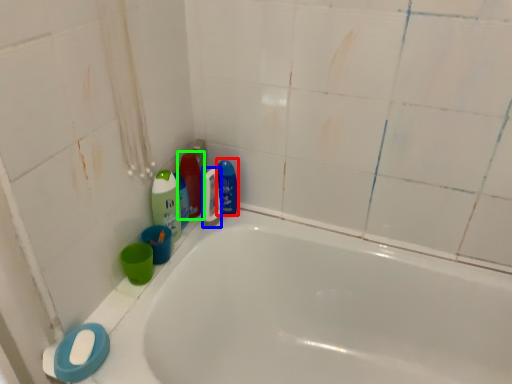
Question: Estimate the real-world distances between objects in this image. Which object is closer to cleaning product (highlighted by a red box), mouthwash (highlighted by a blue box) or cleaning product (highlighted by a green box)?

Choices:
 (A) mouthwash
 (B) cleaning product

Answer: (A)